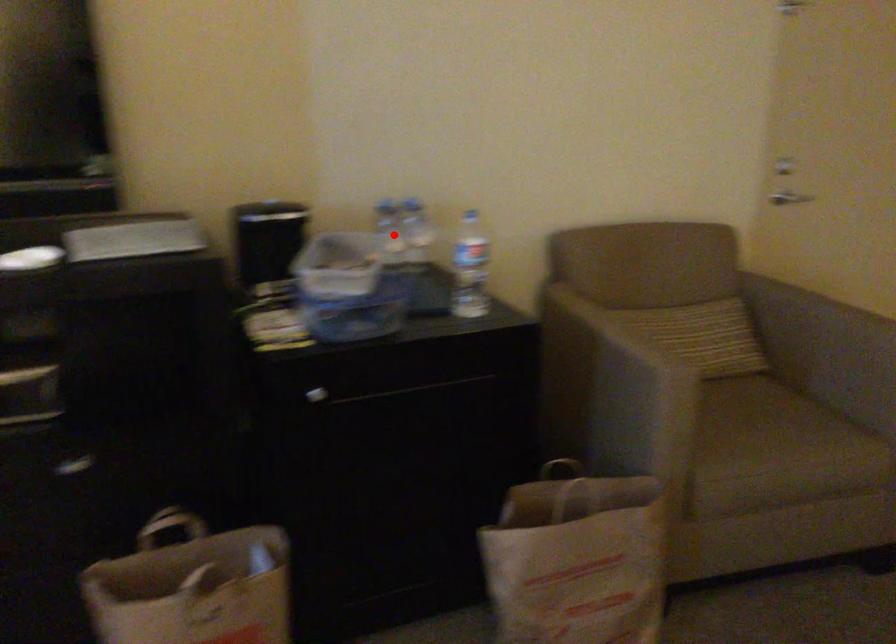
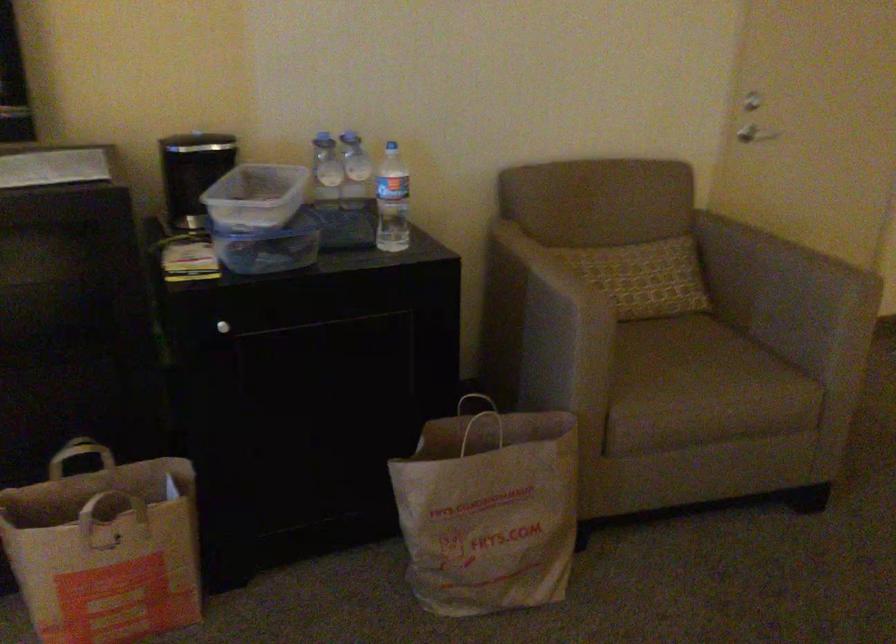
Where in the second image is the point corresponding to the highlighted location from the first image?

(325, 169)